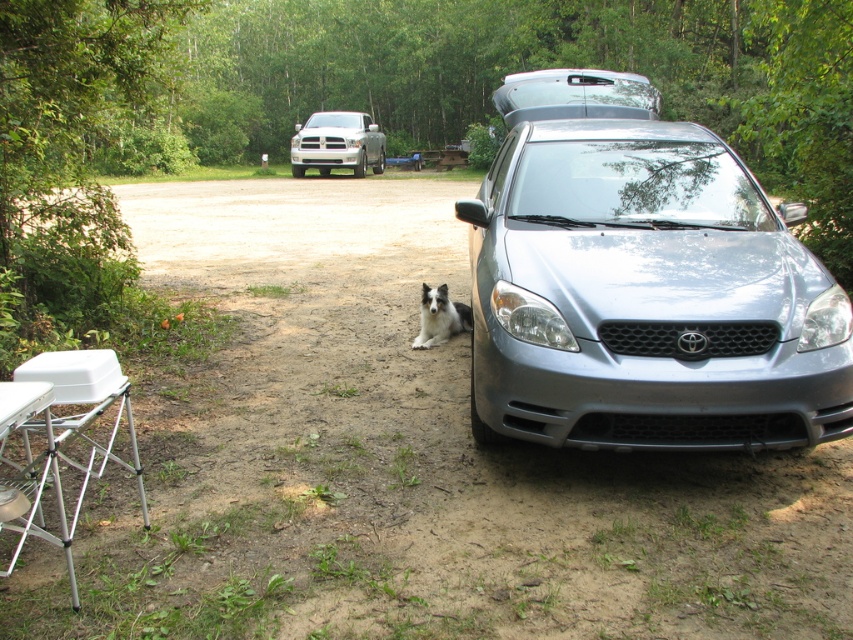
Question: Does satin silver car at center lie behind satin silver minivan at upper center?

Choices:
 (A) no
 (B) yes

Answer: (A)

Question: Does satin silver minivan at upper center have a greater width compared to silver metallic truck at upper center?

Choices:
 (A) yes
 (B) no

Answer: (A)

Question: Which point is farther to the camera?

Choices:
 (A) (434, 326)
 (B) (561, 112)
 (C) (94, 392)

Answer: (B)

Question: Is silver metallic truck at upper center to the right of black and white fur dog at center from the viewer's perspective?

Choices:
 (A) no
 (B) yes

Answer: (A)

Question: Which of the following is the farthest from the observer?

Choices:
 (A) white metallic picnic table at lower left
 (B) black and white fur dog at center
 (C) satin silver minivan at upper center

Answer: (C)

Question: Among these points, which one is nearest to the camera?

Choices:
 (A) (74, 456)
 (B) (357, 147)
 (C) (444, 289)

Answer: (A)